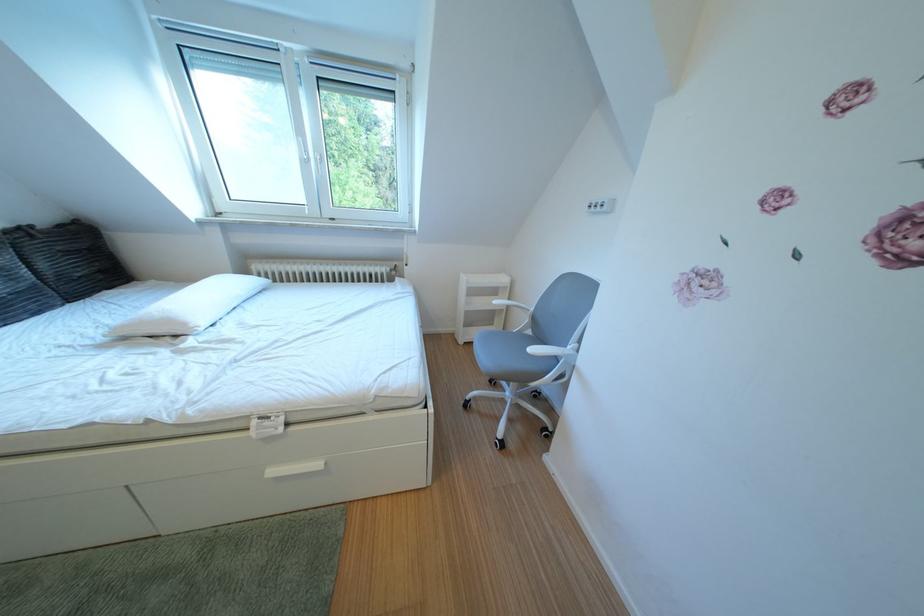
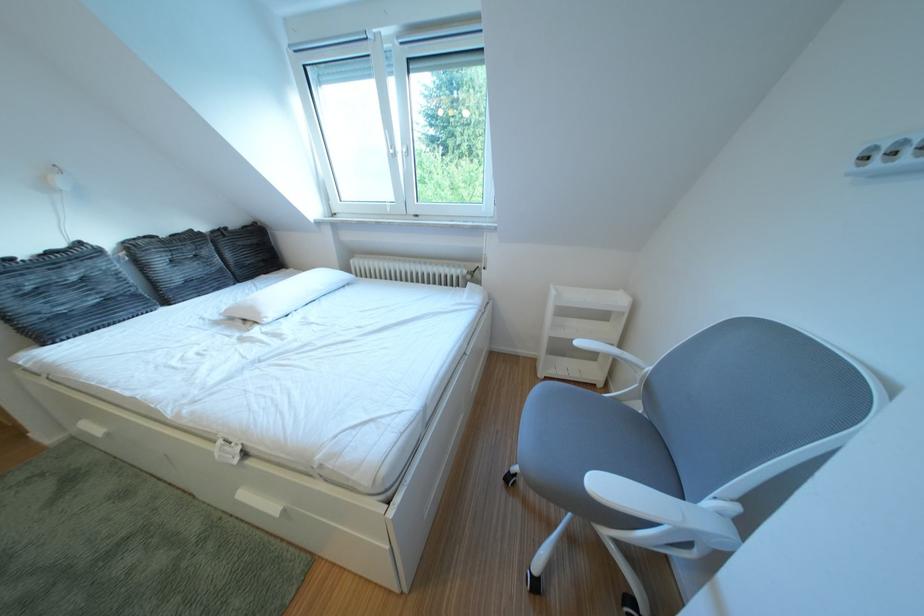
Question: The images are taken continuously from a first-person perspective. In which direction is your viewpoint rotating?

Choices:
 (A) Left
 (B) Right
 (C) Up
 (D) Down

Answer: (A)